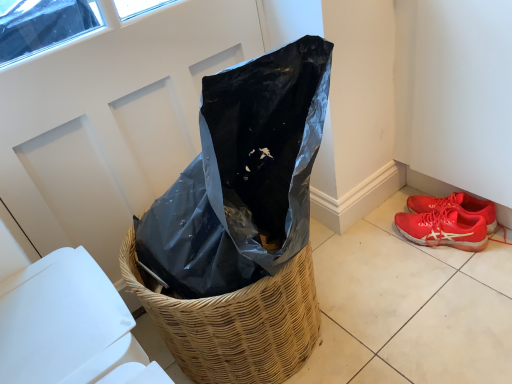
Question: Considering the positions of shiny red sneakers at lower right and woven straw basket at center in the image, is shiny red sneakers at lower right wider or thinner than woven straw basket at center?

Choices:
 (A) wide
 (B) thin

Answer: (B)

Question: From the image's perspective, is shiny red sneakers at lower right positioned above or below woven straw basket at center?

Choices:
 (A) above
 (B) below

Answer: (A)

Question: Looking at the image, does shiny red sneakers at lower right seem bigger or smaller compared to woven straw basket at center?

Choices:
 (A) big
 (B) small

Answer: (B)

Question: Considering the positions of woven straw basket at center and shiny red sneakers at lower right in the image, is woven straw basket at center taller or shorter than shiny red sneakers at lower right?

Choices:
 (A) tall
 (B) short

Answer: (A)

Question: Based on their sizes in the image, would you say woven straw basket at center is bigger or smaller than shiny red sneakers at lower right?

Choices:
 (A) small
 (B) big

Answer: (B)

Question: Considering the positions of woven straw basket at center and shiny red sneakers at lower right in the image, is woven straw basket at center wider or thinner than shiny red sneakers at lower right?

Choices:
 (A) wide
 (B) thin

Answer: (A)

Question: From a real-world perspective, relative to shiny red sneakers at lower right, is woven straw basket at center vertically above or below?

Choices:
 (A) above
 (B) below

Answer: (A)